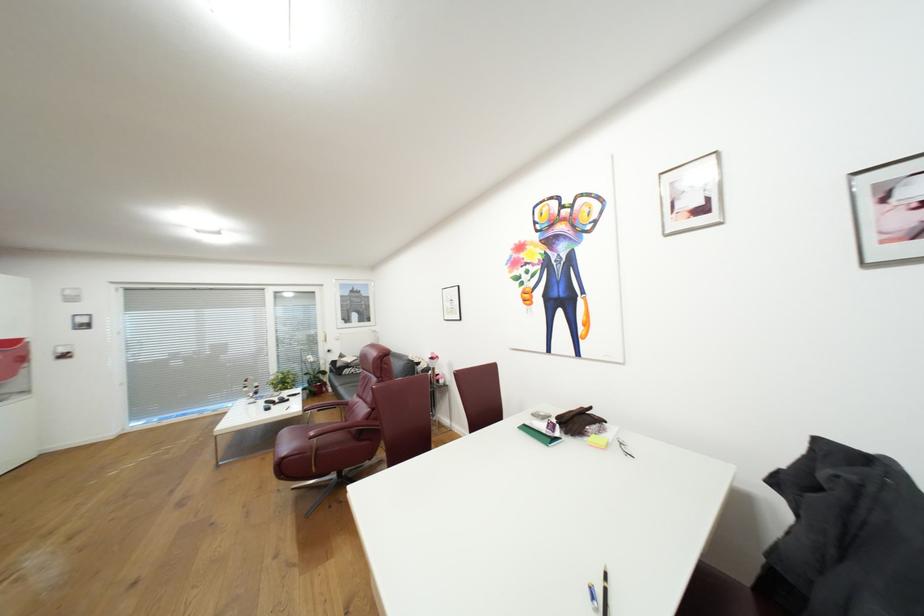
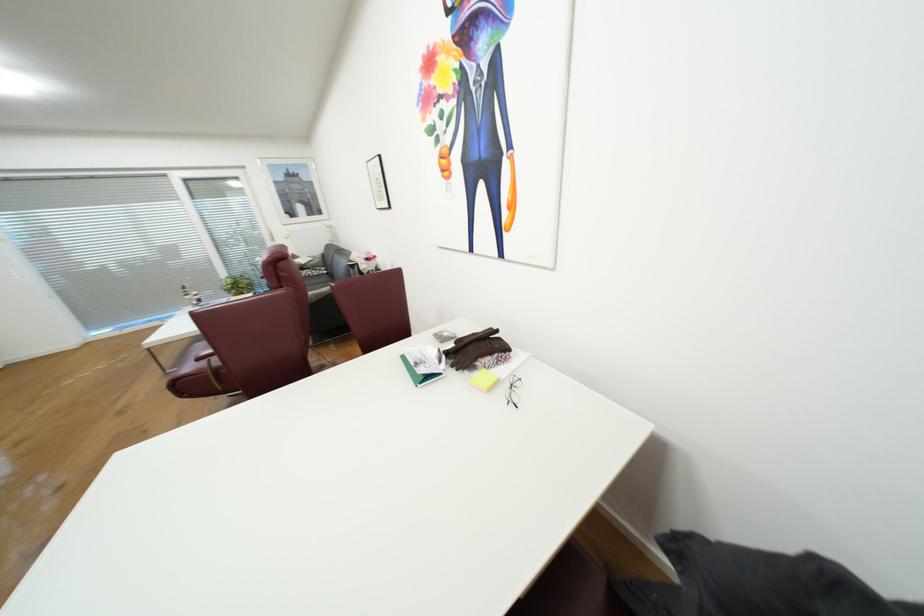
In the second image, find the point that corresponds to the point at 584,422 in the first image.

(481, 350)